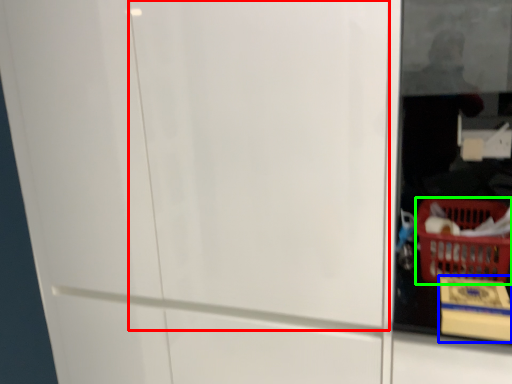
Question: Based on their relative distances, which object is nearer to screen door (highlighted by a red box)? Choose from cardboard box (highlighted by a blue box) and basket (highlighted by a green box).

Choices:
 (A) cardboard box
 (B) basket

Answer: (A)